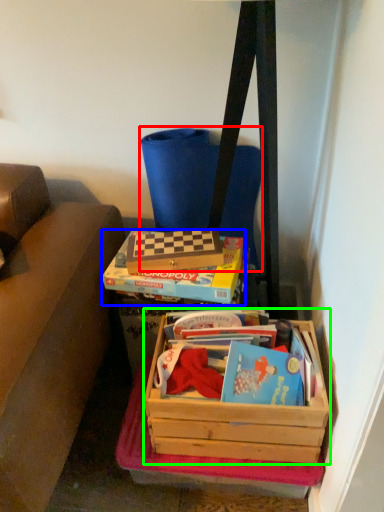
Question: Considering the real-world distances, which object is farthest from messenger bag (highlighted by a red box)? box (highlighted by a blue box) or box (highlighted by a green box)?

Choices:
 (A) box
 (B) box

Answer: (B)